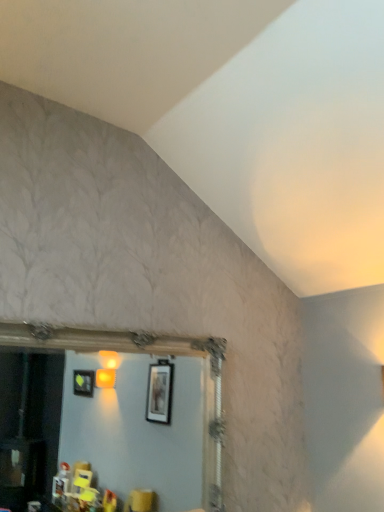
Locate an element on the screen. matte glass mirror at lower left is located at coordinates (141, 410).

This screenshot has width=384, height=512. What do you see at coordinates (141, 410) in the screenshot?
I see `matte glass mirror at lower left` at bounding box center [141, 410].

You are a GUI agent. You are given a task and a screenshot of the screen. Output one action in this format:
    pyautogui.click(x=<x>, y=<y>)
    Task: Click on the matte glass mirror at lower left
    This screenshot has width=384, height=512.
    Given the screenshot: What is the action you would take?
    pyautogui.click(x=141, y=410)